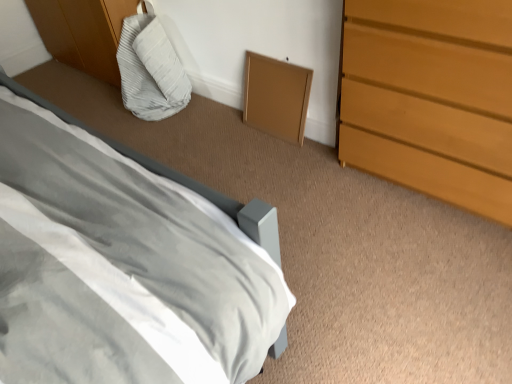
The width and height of the screenshot is (512, 384). I want to click on matte gray bed at lower left, so click(120, 266).

Consider the image. Between matte gray bed at lower left and light brown wooden chest of drawers at right, which one has smaller size?

light brown wooden chest of drawers at right is smaller.

From a real-world perspective, which is physically above, matte gray bed at lower left or light brown wooden chest of drawers at right?

matte gray bed at lower left, from a real-world perspective.

Does matte gray bed at lower left touch light brown wooden chest of drawers at right?

No, matte gray bed at lower left is not with light brown wooden chest of drawers at right.

Considering the positions of objects matte gray bed at lower left and light brown wooden chest of drawers at right in the image provided, who is behind, matte gray bed at lower left or light brown wooden chest of drawers at right?

light brown wooden chest of drawers at right is further away from the camera.

Would you say light brown wooden chest of drawers at right is a long distance from light gray fabric bean bag at upper left?

Yes, light brown wooden chest of drawers at right is far from light gray fabric bean bag at upper left.

Is light brown wooden chest of drawers at right to the left or to the right of light gray fabric bean bag at upper left in the image?

light brown wooden chest of drawers at right is positioned on light gray fabric bean bag at upper left's right side.

Is light brown wooden chest of drawers at right positioned with its back to light gray fabric bean bag at upper left?

No.

From the image's perspective, which is above, light gray fabric bean bag at upper left or matte gray bed at lower left?

light gray fabric bean bag at upper left.

Find the location of a particular element. bean bag chair behind the matte gray bed at lower left is located at coordinates (150, 68).

Can you see light gray fabric bean bag at upper left touching matte gray bed at lower left?

There is a gap between light gray fabric bean bag at upper left and matte gray bed at lower left.

Can you confirm if light gray fabric bean bag at upper left is smaller than matte gray bed at lower left?

Yes, light gray fabric bean bag at upper left is smaller than matte gray bed at lower left.

Which object is thinner, light brown wooden chest of drawers at right or matte gray bed at lower left?

Thinner between the two is matte gray bed at lower left.

From a real-world perspective, relative to matte gray bed at lower left, is light brown wooden chest of drawers at right vertically above or below?

light brown wooden chest of drawers at right is below matte gray bed at lower left.

Is point (426, 99) closer to viewer compared to point (150, 175)?

That is False.

Considering the sizes of light gray fabric bean bag at upper left and light brown wooden chest of drawers at right in the image, is light gray fabric bean bag at upper left wider or thinner than light brown wooden chest of drawers at right?

Clearly, light gray fabric bean bag at upper left has less width compared to light brown wooden chest of drawers at right.

How different are the orientations of light gray fabric bean bag at upper left and light brown wooden chest of drawers at right in degrees?

0.89 degrees.

Who is more distant, light gray fabric bean bag at upper left or light brown wooden chest of drawers at right?

light gray fabric bean bag at upper left is further away from the camera.

Can you tell me how much matte gray bed at lower left and light gray fabric bean bag at upper left differ in facing direction?

179 degrees separate the facing orientations of matte gray bed at lower left and light gray fabric bean bag at upper left.

Would you consider matte gray bed at lower left to be distant from light gray fabric bean bag at upper left?

Yes, matte gray bed at lower left and light gray fabric bean bag at upper left are located far from each other.

In the scene shown: Is matte gray bed at lower left closer to camera compared to light gray fabric bean bag at upper left?

Yes, matte gray bed at lower left is in front of light gray fabric bean bag at upper left.

What are the coordinates of `the chest of drawers directly beneath the matte gray bed at lower left (from a real-world perspective)` in the screenshot? It's located at (431, 98).

Find the location of a particular element. Image resolution: width=512 pixels, height=384 pixels. the chest of drawers above the light gray fabric bean bag at upper left (from a real-world perspective) is located at coordinates pyautogui.click(x=431, y=98).

Which object lies further to the anchor point light gray fabric bean bag at upper left, light brown wooden chest of drawers at right or matte gray bed at lower left?

matte gray bed at lower left is positioned further to the anchor light gray fabric bean bag at upper left.

Estimate the real-world distances between objects in this image. Which object is closer to light brown wooden chest of drawers at right, light gray fabric bean bag at upper left or matte gray bed at lower left?

The object closer to light brown wooden chest of drawers at right is matte gray bed at lower left.

From the picture: Based on their spatial positions, is matte gray bed at lower left or light gray fabric bean bag at upper left further from light brown wooden chest of drawers at right?

light gray fabric bean bag at upper left is positioned further to the anchor light brown wooden chest of drawers at right.

Based on their spatial positions, is light gray fabric bean bag at upper left or light brown wooden chest of drawers at right closer to matte gray bed at lower left?

The object closer to matte gray bed at lower left is light brown wooden chest of drawers at right.

Estimate the real-world distances between objects in this image. Which object is further from matte gray bed at lower left, light brown wooden chest of drawers at right or light gray fabric bean bag at upper left?

Based on the image, light gray fabric bean bag at upper left appears to be further to matte gray bed at lower left.

Looking at this image, which object lies nearer to the anchor point light gray fabric bean bag at upper left, matte gray bed at lower left or light brown wooden chest of drawers at right?

Among the two, light brown wooden chest of drawers at right is located nearer to light gray fabric bean bag at upper left.

At what (x,y) coordinates should I click in order to perform the action: click on the chest of drawers located between matte gray bed at lower left and light gray fabric bean bag at upper left in the depth direction. Please return your answer as a coordinate pair (x, y). The height and width of the screenshot is (384, 512). Looking at the image, I should click on (431, 98).